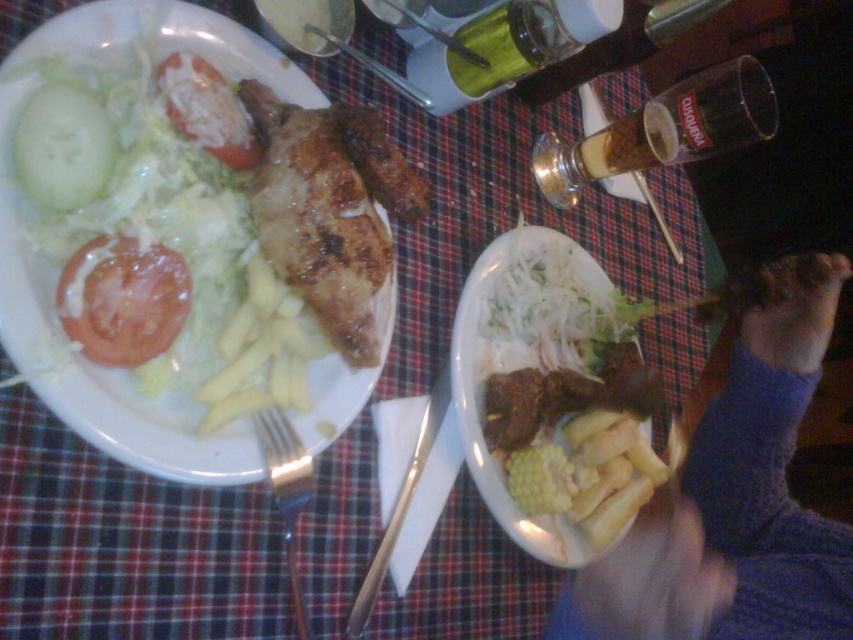
You are a server trying to place a napkin between the metallic spoon at upper center and the brushed metal fork at upper center. Can you fit it there?

The distance between the metallic spoon at upper center and the brushed metal fork at upper center is 14.38 inches. Since a standard napkin is typically around 12 inches wide, there is enough space to fit the napkin between them.

You are a chef preparing a dish and need to choose between the red matte tomato at left and the metallic spoon at upper center. Which object is narrower?

The red matte tomato at left has a lesser width compared to the metallic spoon at upper center, so the red matte tomato at left is narrower.